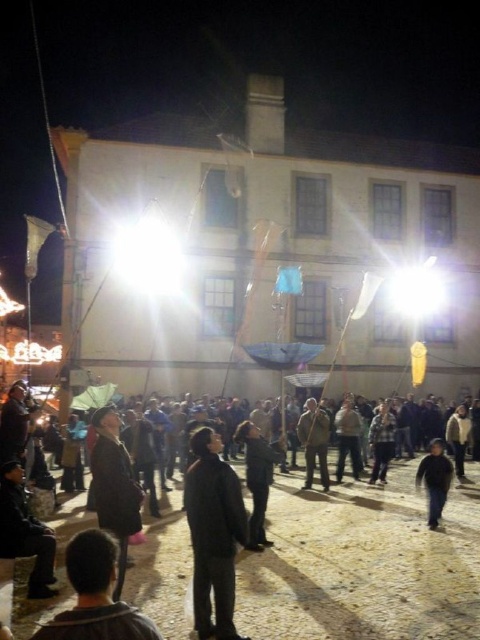
Question: Does black matte jacket at center have a lesser width compared to dark gray fabric jacket at center?

Choices:
 (A) yes
 (B) no

Answer: (B)

Question: Based on their relative distances, which object is nearer to the dark gray fabric at center?

Choices:
 (A) black matte jacket at center
 (B) dark gray fabric jacket at center

Answer: (B)

Question: Which of the following is the farthest from the observer?

Choices:
 (A) 266,458
 (B) 200,499
 (C) 434,468

Answer: (C)

Question: Is dark gray fabric jacket at center below dark gray fabric at center?

Choices:
 (A) yes
 (B) no

Answer: (B)

Question: Which object appears closest to the camera in this image?

Choices:
 (A) dark gray fabric at center
 (B) black matte jacket at center
 (C) dark gray fabric jacket at center
 (D) dark blue jeans at lower right

Answer: (B)

Question: Is black matte jacket at center smaller than dark gray fabric jacket at center?

Choices:
 (A) no
 (B) yes

Answer: (B)